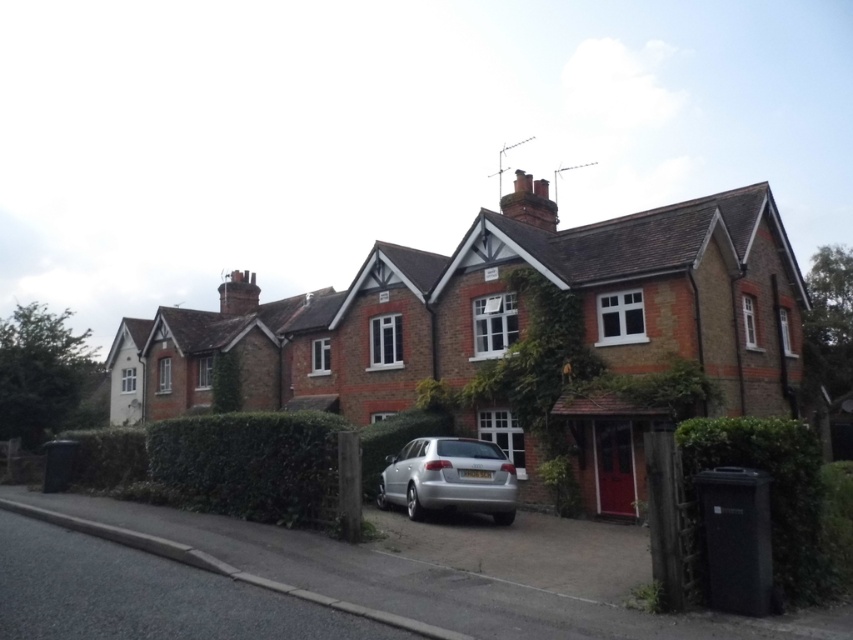
You are standing at the point marked by the coordinates point (772, 486). What object are you standing on?

You are standing on the green leafy hedge at lower right.